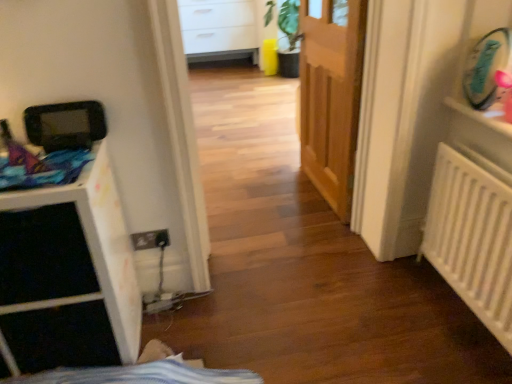
You are a GUI agent. You are given a task and a screenshot of the screen. Output one action in this format:
    pyautogui.click(x=<x>, y=<y>)
    Task: Click on the free space to the left of wooden door at center
    Image resolution: width=512 pixels, height=384 pixels.
    Given the screenshot: What is the action you would take?
    pyautogui.click(x=271, y=201)